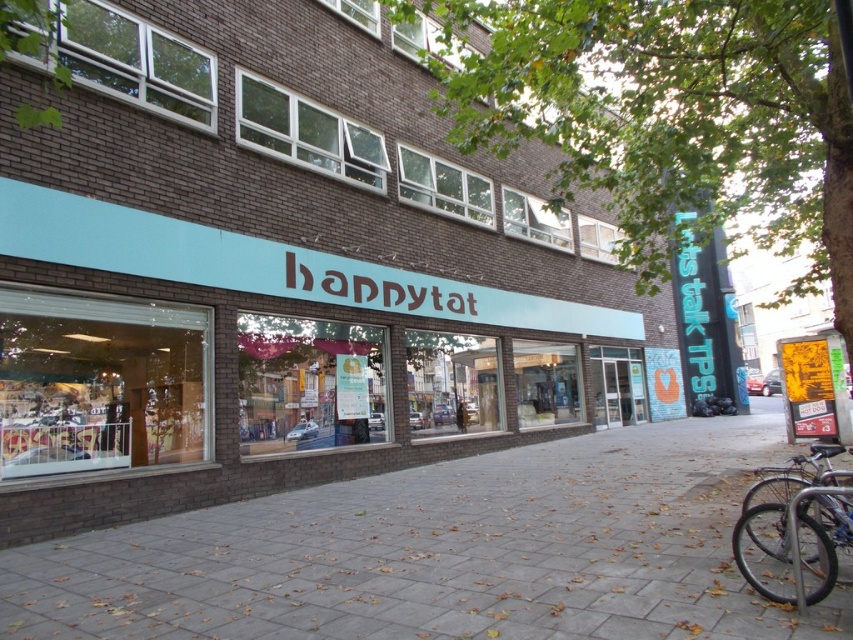
You are standing in front of the storefront and want to place a large box on the gray brick pavement at center. Can you confirm if there is enough space for the box compared to the silver metallic bicycle at lower right?

The gray brick pavement at center is bigger than the silver metallic bicycle at lower right, so there should be sufficient space to place the large box there.

You are standing in front of the storefront and want to place a small potted plant between the gray brick pavement at center and the silver metallic bicycle at lower right. Based on their positions, which object should the plant be closer to?

The gray brick pavement at center is closer to the viewer than the silver metallic bicycle at lower right, so the plant should be placed closer to the silver metallic bicycle at lower right to maintain the spatial relationship.

You are standing in front of the storefront and notice the gray brick pavement at center and the silver metallic bicycle at lower right. Which object appears taller in the image?

The gray brick pavement at center is taller than the silver metallic bicycle at lower right.